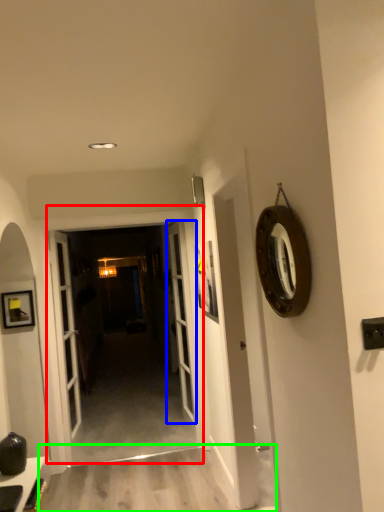
Question: Which object is positioned closest to door (highlighted by a red box)? Select from door (highlighted by a blue box) and path (highlighted by a green box).

Choices:
 (A) door
 (B) path

Answer: (A)